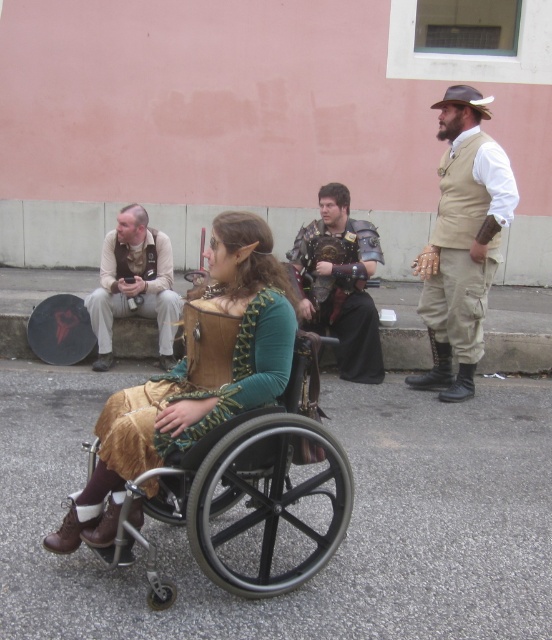
Which is in front, point (268, 348) or point (129, 250)?

Point (268, 348) is in front.

Is point (211, 317) farther from viewer compared to point (163, 317)?

No, (211, 317) is in front of (163, 317).

Image resolution: width=552 pixels, height=640 pixels. I want to click on leather-like vest at center, so click(200, 390).

Who is lower down, black rubber wheelchair at center or beige leather vest at center?

black rubber wheelchair at center

Does point (300, 493) come farther from viewer compared to point (103, 253)?

No.

Where is `black rubber wheelchair at center`? The image size is (552, 640). black rubber wheelchair at center is located at coordinates pyautogui.click(x=258, y=492).

Can you confirm if metallic armor at center is positioned above beige leather vest at center?

Indeed, metallic armor at center is positioned over beige leather vest at center.

Which is in front, point (321, 205) or point (110, 362)?

Point (321, 205) is in front.

Where is `metallic armor at center`? metallic armor at center is located at coordinates (341, 282).